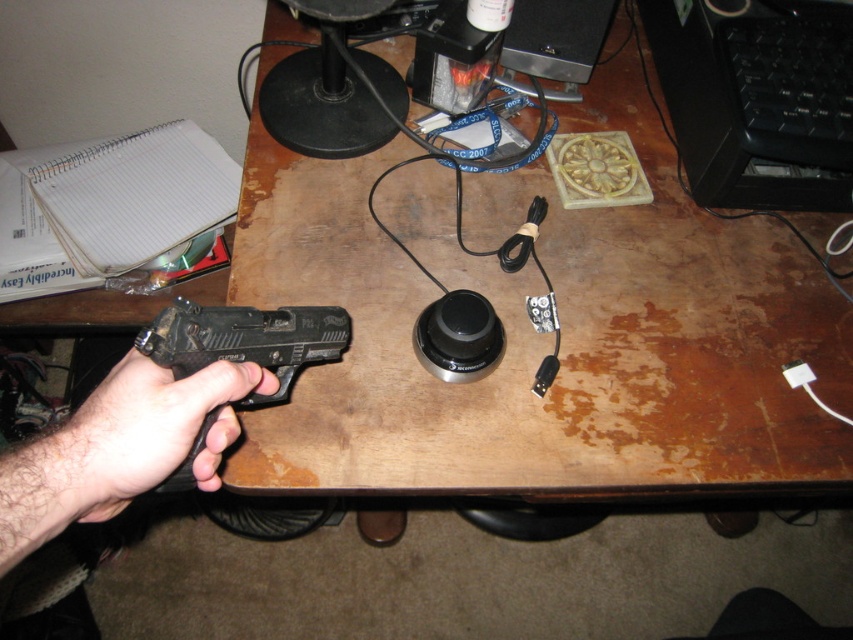
Question: Can you confirm if black matte gun at lower left is positioned to the left of black matte handgun at left?

Choices:
 (A) yes
 (B) no

Answer: (A)

Question: Considering the relative positions of black matte gun at lower left and black matte handgun at left in the image provided, where is black matte gun at lower left located with respect to black matte handgun at left?

Choices:
 (A) above
 (B) below

Answer: (B)

Question: Does brown wooden desk at center appear on the right side of black matte gun at lower left?

Choices:
 (A) no
 (B) yes

Answer: (B)

Question: Which point is farther from the camera taking this photo?

Choices:
 (A) (573, 465)
 (B) (218, 307)
 (C) (189, 388)

Answer: (A)

Question: Estimate the real-world distances between objects in this image. Which object is closer to the black matte handgun at left?

Choices:
 (A) black matte gun at lower left
 (B) brown wooden desk at center

Answer: (A)

Question: Which object is farther from the camera taking this photo?

Choices:
 (A) black matte handgun at left
 (B) black matte gun at lower left

Answer: (A)